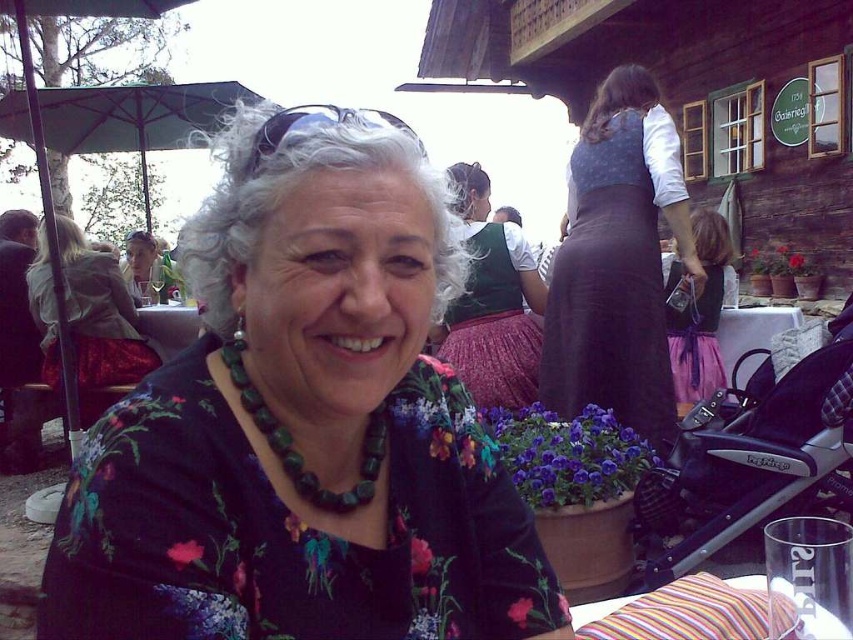
Which is behind, point (494, 285) or point (141, 298)?

Positioned behind is point (141, 298).

At what (x,y) coordinates should I click in order to perform the action: click on green velvet blouse at center. Please return your answer as a coordinate pair (x, y). Looking at the image, I should click on (492, 301).

Who is more forward, (531, 296) or (155, 300)?

Point (531, 296) is in front.

The width and height of the screenshot is (853, 640). Find the location of `green velvet blouse at center`. green velvet blouse at center is located at coordinates (492, 301).

Does point (618, 316) lie in front of point (676, 580)?

No.

Can you confirm if dark purple skirt at upper right is taller than striped fabric table at lower right?

Yes, dark purple skirt at upper right is taller than striped fabric table at lower right.

Who is more distant from viewer, (602, 220) or (756, 596)?

The point (602, 220) is behind.

At what (x,y) coordinates should I click in order to perform the action: click on dark purple skirt at upper right. Please return your answer as a coordinate pair (x, y). Looking at the image, I should click on (618, 262).

Find the location of a particular element. dark purple skirt at upper right is located at coordinates (618, 262).

Looking at this image, is dark purple skirt at upper right bigger than green beaded necklace at center?

Correct, dark purple skirt at upper right is larger in size than green beaded necklace at center.

Image resolution: width=853 pixels, height=640 pixels. What do you see at coordinates (618, 262) in the screenshot?
I see `dark purple skirt at upper right` at bounding box center [618, 262].

I want to click on dark purple skirt at upper right, so click(x=618, y=262).